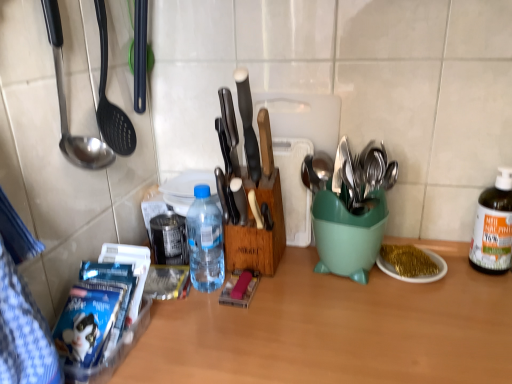
Where is `blank space to the left of green plastic bottle at right, the first bottle in the right-to-left sequence`? This screenshot has height=384, width=512. blank space to the left of green plastic bottle at right, the first bottle in the right-to-left sequence is located at coordinates (439, 285).